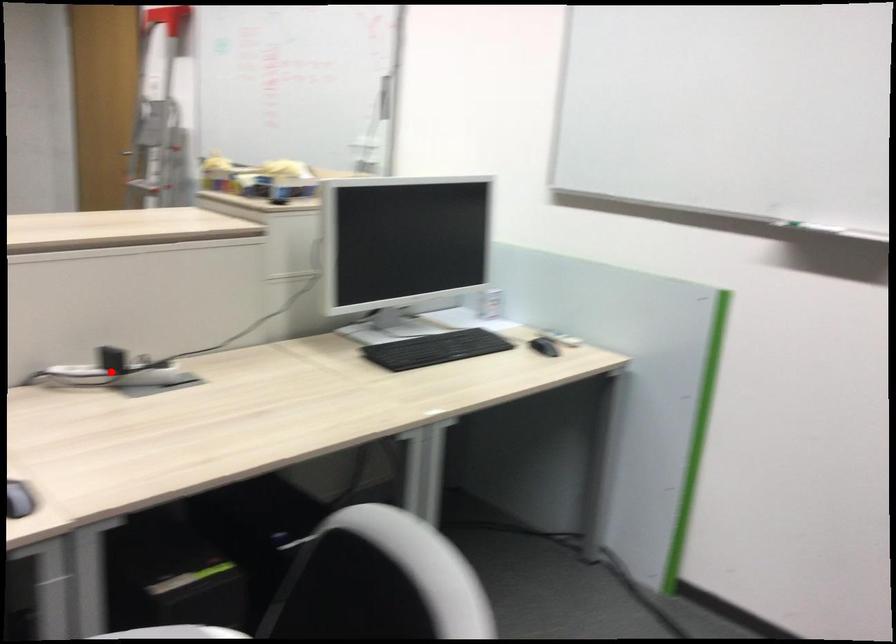
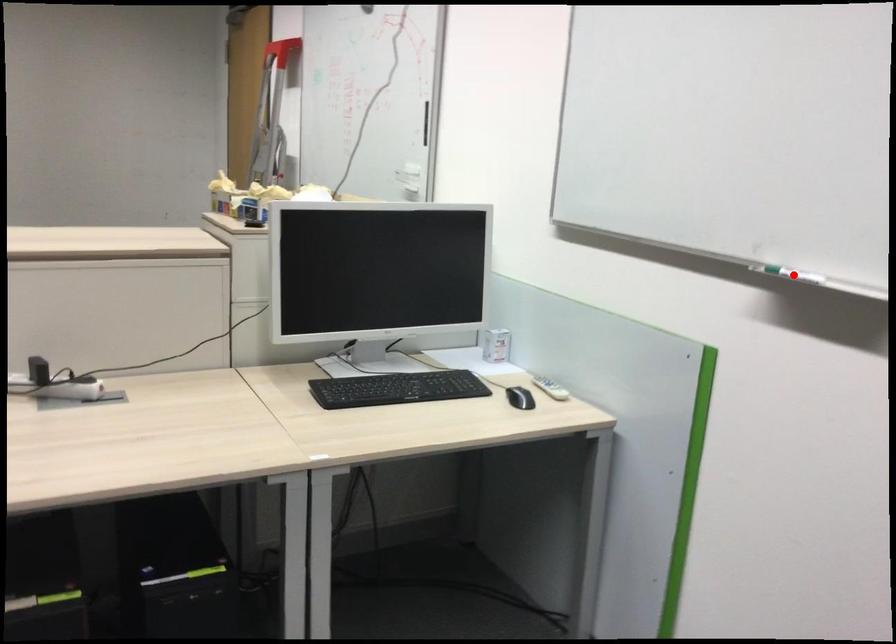
I am providing you with two images of the same scene from different viewpoints. A red point is marked on the first image and another point is marked on the second image. Is the red point in image1 aligned with the point shown in image2?

No